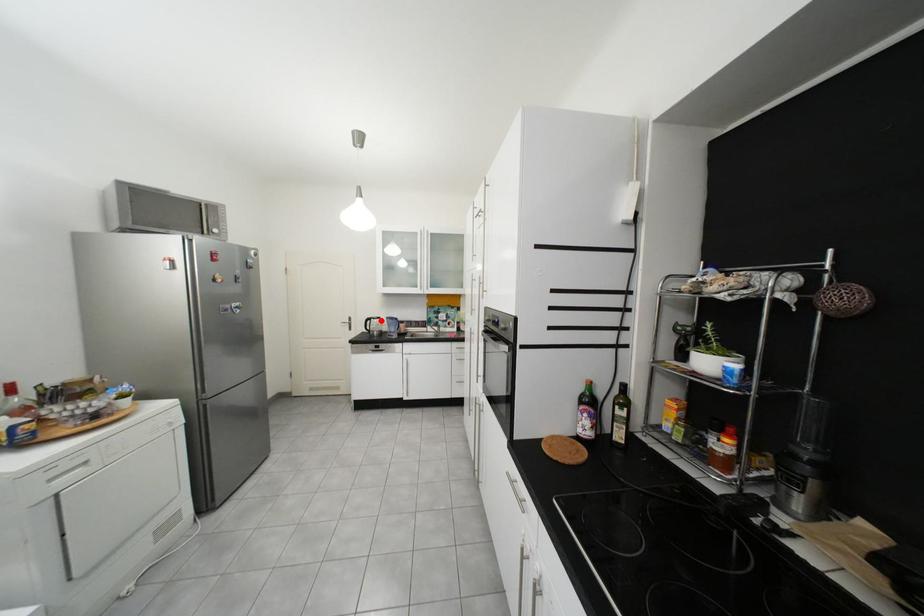
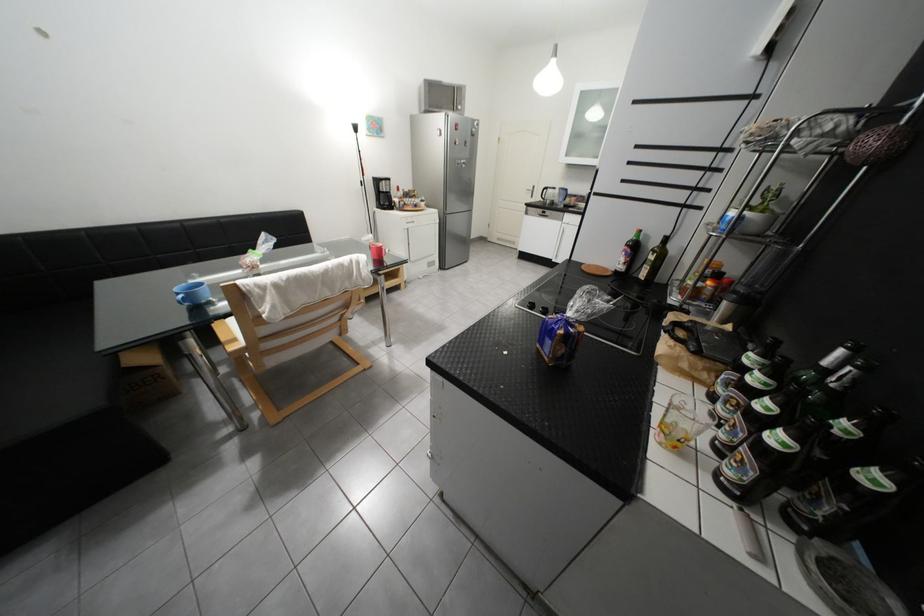
Find the pixel in the second image that matches the highlighted location in the first image.

(557, 190)